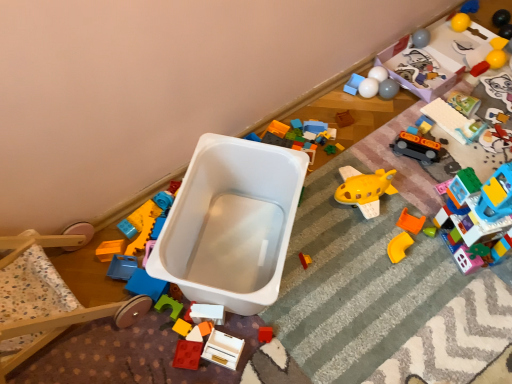
I want to click on vacant area that lies between orange matte plastic corner piece at lower right, the eighth toy positioned from the left, and translucent plastic building blocks at right, positioned as the 12th toy in left-to-right order, so click(425, 250).